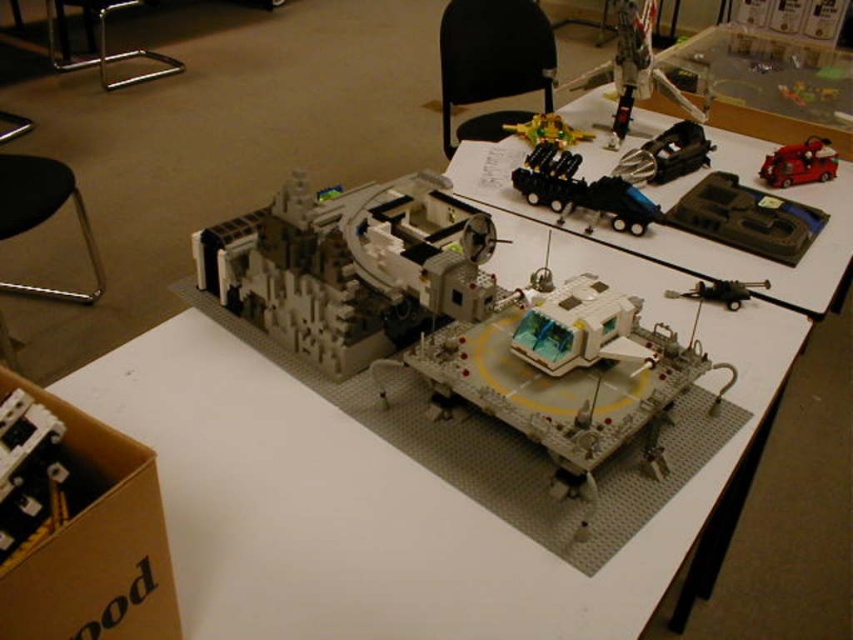
You are looking at the LEGO space station model from the front. There are two points marked on the model, one at coordinate point (579, 368) and another at point (538, 120). Which point is closer to your eyes?

Point (579, 368) is closer to the camera than point (538, 120), so the point at coordinate point (579, 368) is closer to your eyes.

You are a guest at a LEGO exhibition and want to take a photo of the translucent plastic building at center without the black metal stool at lower left appearing in the frame. Where should you stand relative to the stool to ensure it doesn not block your view?

The translucent plastic building at center is positioned on the right side of the black metal stool at lower left. To avoid the stool blocking the view, you should stand to the right of the stool so that the building is on the right side of the stool and not obstructed.